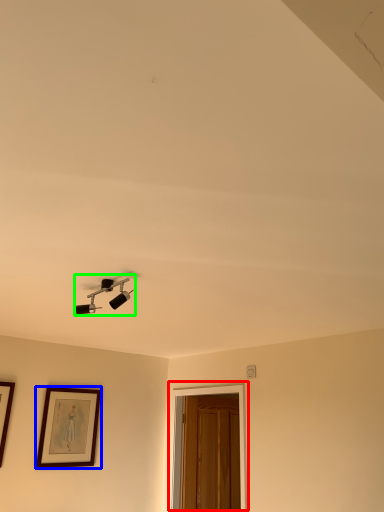
Question: Which object is the farthest from glass door (highlighted by a red box)? Choose among these: picture frame (highlighted by a blue box) or lamp (highlighted by a green box).

Choices:
 (A) picture frame
 (B) lamp

Answer: (B)